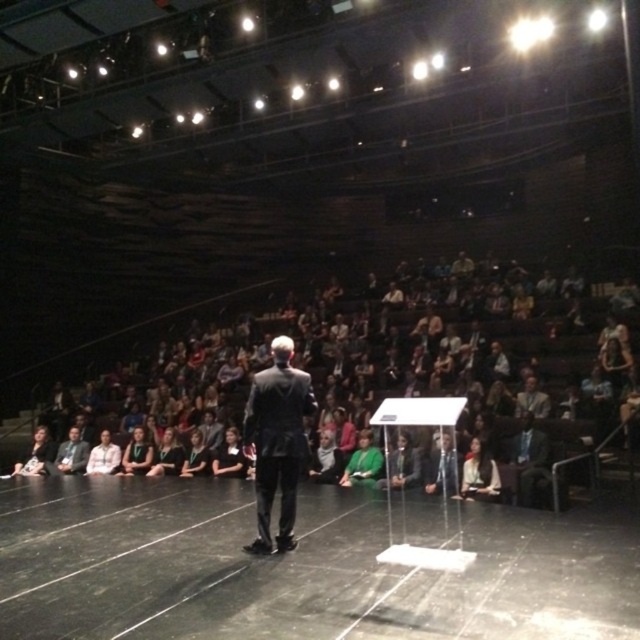
Question: From the image, what is the correct spatial relationship of dark green fabric seats at center in relation to black smooth stage at center?

Choices:
 (A) below
 (B) above

Answer: (B)

Question: Estimate the real-world distances between objects in this image. Which object is farther from the white fabric shirt at lower center?

Choices:
 (A) dark gray suit at lower left
 (B) matte black suit at center
 (C) green fabric at center
 (D) black smooth stage at center

Answer: (D)

Question: Which point appears farthest from the camera in this image?

Choices:
 (A) (365, 456)
 (B) (452, 477)

Answer: (A)

Question: Does dark green fabric seats at center have a lesser width compared to dark gray suit at lower left?

Choices:
 (A) no
 (B) yes

Answer: (A)

Question: Does green fabric at center have a greater width compared to white shirt at center?

Choices:
 (A) yes
 (B) no

Answer: (B)

Question: Which object is the closest to the matte black suit at center?

Choices:
 (A) white shirt at center
 (B) dark gray suit at lower left

Answer: (A)